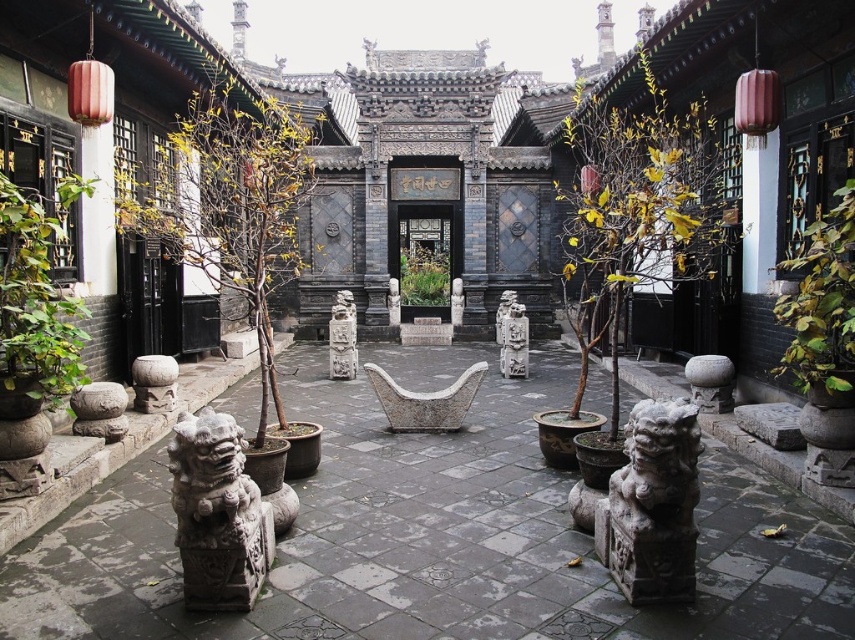
Is point (557, 506) positioned after point (615, 580)?

Yes.

Where is `stone lion statues at center`? The image size is (855, 640). stone lion statues at center is located at coordinates (433, 536).

Does point (154, 584) come farther from viewer compared to point (694, 464)?

That is True.

The image size is (855, 640). I want to click on stone lion statues at center, so click(433, 536).

Is gray stone lion at lower center to the left of green leafy plant at left from the viewer's perspective?

Incorrect, gray stone lion at lower center is not on the left side of green leafy plant at left.

Who is more forward, (629, 435) or (42, 300)?

Point (629, 435)

The image size is (855, 640). What do you see at coordinates (653, 504) in the screenshot?
I see `gray stone lion at lower center` at bounding box center [653, 504].

Locate an element on the screen. gray stone lion at lower center is located at coordinates (653, 504).

Is point (644, 124) positioned behind point (136, 401)?

Yes.

Measure the distance between yellow-green leaves at center and gray stone head at lower left.

They are 35.17 meters apart.

What do you see at coordinates (637, 205) in the screenshot? This screenshot has width=855, height=640. I see `yellow-green leaves at center` at bounding box center [637, 205].

You are a GUI agent. You are given a task and a screenshot of the screen. Output one action in this format:
    pyautogui.click(x=<x>, y=<y>)
    Task: Click on the yellow-green leaves at center
    The image size is (855, 640).
    Given the screenshot: What is the action you would take?
    point(637,205)